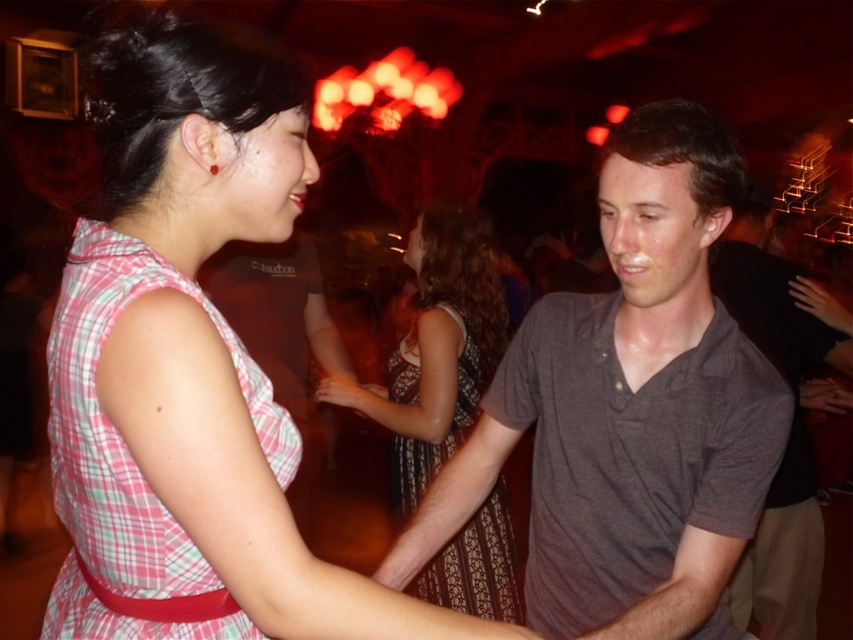
You are at a party and want to know which dress is shorter between the pink plaid dress at center and the patterned fabric dress at center. Can you tell me?

The pink plaid dress at center is shorter than the patterned fabric dress at center.

You are at a party and want to take a photo of both the gray cotton shirt at center and the patterned fabric dress at center. Can you fit both in your camera frame if the shirt is wider than the dress?

The gray cotton shirt at center is wider than the patterned fabric dress at center. Since the shirt is wider, you need to ensure your camera frame is wide enough to accommodate the shirt, which would also include the dress. If the frame can fit the shirt, the dress should also fit as it is narrower.

Based on the photo, you are standing in the middle of the dance floor and see two points marked in the image. Which point, point (286, 604) or point (407, 588), is closer to you?

Point (286, 604) is closer to the viewer than point (407, 588).